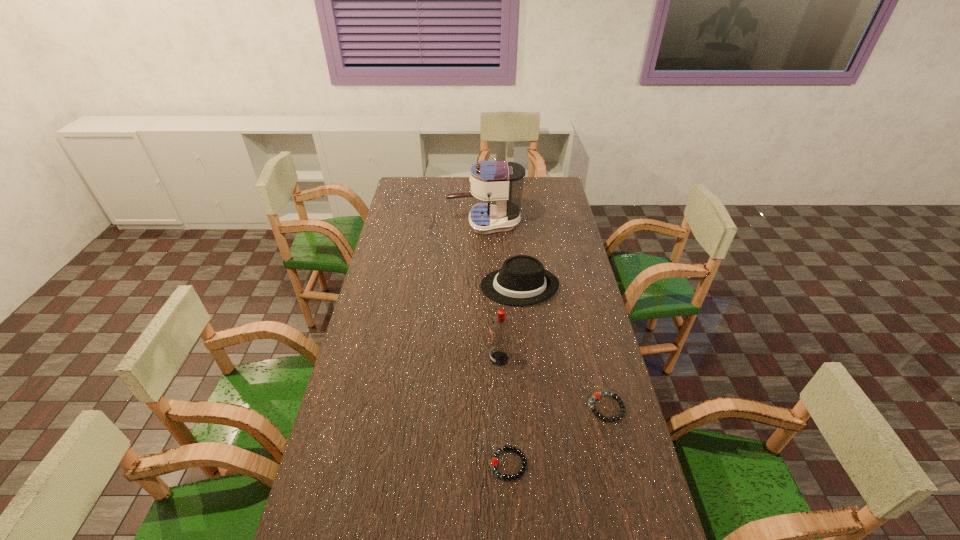
You are a GUI agent. You are given a task and a screenshot of the screen. Output one action in this format:
    pyautogui.click(x=<x>, y=<y>)
    Task: Click on the free space between the nearer bracelet and the second nearest object
    The width and height of the screenshot is (960, 540).
    Given the screenshot: What is the action you would take?
    pyautogui.click(x=558, y=436)

This screenshot has height=540, width=960. I want to click on unoccupied area between the third nearest object and the farther bracelet, so click(x=553, y=383).

At what (x,y) coordinates should I click in order to perform the action: click on free space between the nearer bracelet and the farther bracelet. Please return your answer as a coordinate pair (x, y). Looking at the image, I should click on (558, 436).

Image resolution: width=960 pixels, height=540 pixels. What are the coordinates of `vacant space that's between the farthest object and the right bracelet` in the screenshot? It's located at (545, 315).

Locate which object ranks in proximity to the third tallest object. Please provide its 2D coordinates. Your answer should be formatted as a tuple, i.e. [(x, y)], where the tuple contains the x and y coordinates of a point satisfying the conditions above.

[(500, 328)]

You are a GUI agent. You are given a task and a screenshot of the screen. Output one action in this format:
    pyautogui.click(x=<x>, y=<y>)
    Task: Click on the object that is the closest to the tallest object
    The height and width of the screenshot is (540, 960).
    Given the screenshot: What is the action you would take?
    pyautogui.click(x=522, y=280)

In order to click on vacant space that satisfies the following two spatial constraints: 1. on the front label of the farther bracelet; 2. on the right side of the vodka in this screenshot , I will do `click(501, 408)`.

Locate an element on the screen. blank space that satisfies the following two spatial constraints: 1. on the back side of the nearest object; 2. on the front-facing side of the farthest object is located at coordinates (497, 223).

At what (x,y) coordinates should I click in order to perform the action: click on free region that satisfies the following two spatial constraints: 1. on the back side of the right bracelet; 2. on the front-facing side of the tallest object. Please return your answer as a coordinate pair (x, y). This screenshot has width=960, height=540. Looking at the image, I should click on (562, 223).

Where is `vacant space that satisfies the following two spatial constraints: 1. on the front-facing side of the nearer bracelet; 2. on the right side of the farthest object`? vacant space that satisfies the following two spatial constraints: 1. on the front-facing side of the nearer bracelet; 2. on the right side of the farthest object is located at coordinates (489, 464).